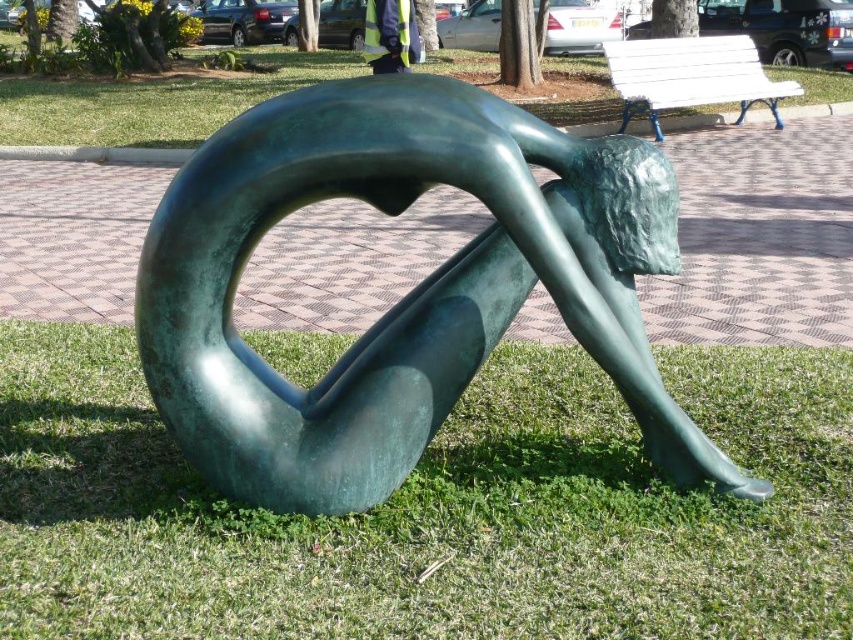
You are standing in front of the bronze sculpture and want to take a photo. You notice two points on the sculpture labeled as point (646, 506) and point (573, 275). Which point is closer to your camera when taking the photo?

Point (573, 275) is closer to the camera than point (646, 506) because the latter is further away from the viewer.

You are a painter carrying a 1.2 meter wide canvas. You want to set it down on the grassy area near the bronze sculpture. Which object, the white wooden bench at upper right or the yellow reflective vest at center, would allow you to place your canvas without it overlapping?

The white wooden bench at upper right might be wider than yellow reflective vest at center, so placing the canvas near the white wooden bench at upper right is more likely to have enough space.

You are a visitor at an outdoor art exhibition and see the bronze sculpture. You need to find the yellow reflective vest at center. Where would you look relative to the green grass at lower center?

The yellow reflective vest at center is on the left side of the green grass at lower center because the green grass at lower center is positioned on the right side of yellow reflective vest at center.